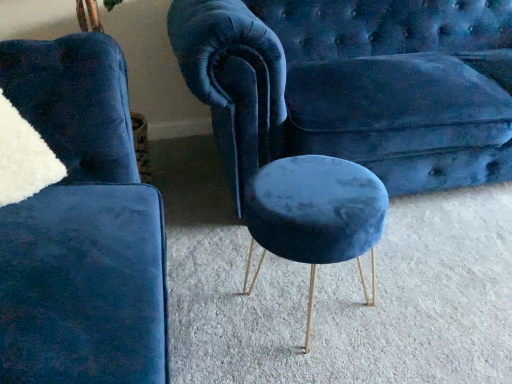
At what (x,y) coordinates should I click in order to perform the action: click on vacant space in front of velvet blue stool at center. Please return your answer as a coordinate pair (x, y). Looking at the image, I should click on (323, 360).